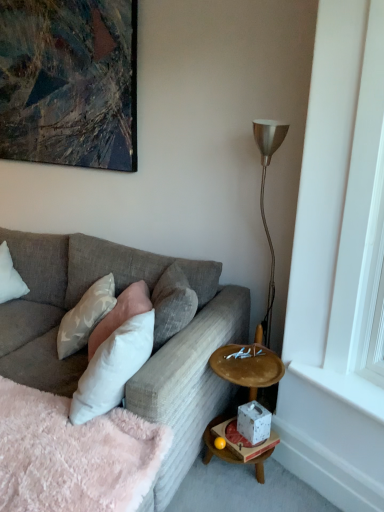
Measure the distance between soft gray fabric pillow at center, the 1th pillow viewed from the right, and camera.

soft gray fabric pillow at center, the 1th pillow viewed from the right, and camera are 5.72 feet apart from each other.

Identify the location of white soft pillow at center, acting as the second pillow starting from the right. (121, 314).

What do you see at coordinates (59, 300) in the screenshot?
I see `textured gray couch at center` at bounding box center [59, 300].

Locate an element on the screen. white paper tissue box at lower right is located at coordinates (215, 447).

Does soft gray fabric pillow at center, which is the third pillow in left-to-right order, lie behind white speckled ceramic at lower right?

That is False.

Is soft gray fabric pillow at center, which is the third pillow in left-to-right order, not close to white speckled ceramic at lower right?

No, there isn't a large distance between soft gray fabric pillow at center, which is the third pillow in left-to-right order, and white speckled ceramic at lower right.

From a real-world perspective, is soft gray fabric pillow at center, which is the third pillow in left-to-right order, positioned over white speckled ceramic at lower right based on gravity?

Yes, from a real-world perspective, soft gray fabric pillow at center, which is the third pillow in left-to-right order, is above white speckled ceramic at lower right.

Between soft gray fabric pillow at center, which is the third pillow in left-to-right order, and white speckled ceramic at lower right, which one has larger size?

Bigger between the two is soft gray fabric pillow at center, which is the third pillow in left-to-right order.

Does fluffy pink blanket at lower left contain white soft pillow at left, marked as the first pillow in a left-to-right arrangement?

No, white soft pillow at left, marked as the first pillow in a left-to-right arrangement, is located outside of fluffy pink blanket at lower left.

Locate an element on the screen. pillow on the left of the fluffy pink blanket at lower left is located at coordinates (10, 277).

Can you confirm if fluffy pink blanket at lower left is wider than white soft pillow at left, marked as the first pillow in a left-to-right arrangement?

Indeed, fluffy pink blanket at lower left has a greater width compared to white soft pillow at left, marked as the first pillow in a left-to-right arrangement.

Based on their sizes in the image, would you say fluffy pink blanket at lower left is bigger or smaller than white soft pillow at left, which is counted as the 3th pillow, starting from the right?

fluffy pink blanket at lower left is bigger than white soft pillow at left, which is counted as the 3th pillow, starting from the right.

Based on the photo, from the image's perspective, is white speckled ceramic at lower right beneath white smooth window sill at lower right?

Yes, from the image's perspective, white speckled ceramic at lower right is below white smooth window sill at lower right.

Do you think white speckled ceramic at lower right is within white smooth window sill at lower right, or outside of it?

The correct answer is: outside.

Is white speckled ceramic at lower right facing away from white smooth window sill at lower right?

No, white speckled ceramic at lower right is not facing the opposite direction of white smooth window sill at lower right.

From the image's perspective, is metallic abstract painting at upper left under fluffy pink blanket at lower left?

Actually, metallic abstract painting at upper left appears above fluffy pink blanket at lower left in the image.

Is metallic abstract painting at upper left aimed at fluffy pink blanket at lower left?

No, metallic abstract painting at upper left is not oriented towards fluffy pink blanket at lower left.

How many degrees apart are the facing directions of metallic abstract painting at upper left and fluffy pink blanket at lower left?

The angle between the facing direction of metallic abstract painting at upper left and the facing direction of fluffy pink blanket at lower left is 0.97 degrees.

From a real-world perspective, who is located higher, metallic abstract painting at upper left or fluffy pink blanket at lower left?

metallic abstract painting at upper left, from a real-world perspective.

Considering the sizes of white paper tissue box at lower right and soft gray fabric pillow at center, which is the third pillow in left-to-right order, in the image, is white paper tissue box at lower right bigger or smaller than soft gray fabric pillow at center, which is the third pillow in left-to-right order,?

white paper tissue box at lower right is smaller than soft gray fabric pillow at center, which is the third pillow in left-to-right order.

Considering the points (256, 467) and (184, 315), which point is in front, point (256, 467) or point (184, 315)?

Point (184, 315)

There is a white paper tissue box at lower right. Where is `the 3rd pillow above it (from a real-world perspective)`? The width and height of the screenshot is (384, 512). the 3rd pillow above it (from a real-world perspective) is located at coordinates (172, 304).

Is soft gray fabric pillow at center, the 1th pillow viewed from the right, at the back of white paper tissue box at lower right?

That's not correct — white paper tissue box at lower right is not looking away from soft gray fabric pillow at center, the 1th pillow viewed from the right.

From a real-world perspective, who is located lower, textured gray couch at center or white soft pillow at left, marked as the first pillow in a left-to-right arrangement?

From a 3D spatial view, textured gray couch at center is below.

Is textured gray couch at center positioned in front of white soft pillow at left, which is counted as the 3th pillow, starting from the right?

Yes, the depth of textured gray couch at center is less than that of white soft pillow at left, which is counted as the 3th pillow, starting from the right.

Is textured gray couch at center facing away from white soft pillow at left, marked as the first pillow in a left-to-right arrangement?

That's not correct — textured gray couch at center is not looking away from white soft pillow at left, marked as the first pillow in a left-to-right arrangement.

Looking at their sizes, would you say textured gray couch at center is wider or thinner than white soft pillow at left, which is counted as the 3th pillow, starting from the right?

Clearly, textured gray couch at center has more width compared to white soft pillow at left, which is counted as the 3th pillow, starting from the right.

Are white smooth window sill at lower right and metallic abstract painting at upper left far apart?

Indeed, white smooth window sill at lower right is not near metallic abstract painting at upper left.

From the image's perspective, would you say white smooth window sill at lower right is shown under metallic abstract painting at upper left?

Indeed, from the image's perspective, white smooth window sill at lower right is shown beneath metallic abstract painting at upper left.

Considering the sizes of objects white smooth window sill at lower right and metallic abstract painting at upper left in the image provided, who is thinner, white smooth window sill at lower right or metallic abstract painting at upper left?

metallic abstract painting at upper left is thinner.

From a real-world perspective, is white smooth window sill at lower right positioned over metallic abstract painting at upper left based on gravity?

No, from a real-world perspective, white smooth window sill at lower right is not on top of metallic abstract painting at upper left.

Where is `candle holder below the soft gray fabric pillow at center, which is the third pillow in left-to-right order (from a real-world perspective)`? The height and width of the screenshot is (512, 384). candle holder below the soft gray fabric pillow at center, which is the third pillow in left-to-right order (from a real-world perspective) is located at coordinates (254, 422).

Identify the location of bedding in front of the white soft pillow at left, marked as the first pillow in a left-to-right arrangement. (73, 455).

When comparing their distances from white smooth window sill at lower right, does soft gray fabric pillow at center, which is the third pillow in left-to-right order, or white soft pillow at left, which is counted as the 3th pillow, starting from the right, seem further?

white soft pillow at left, which is counted as the 3th pillow, starting from the right, is positioned further to the anchor white smooth window sill at lower right.

Based on their spatial positions, is metallic abstract painting at upper left or fluffy pink blanket at lower left closer to white smooth window sill at lower right?

Based on the image, fluffy pink blanket at lower left appears to be nearer to white smooth window sill at lower right.

When comparing their distances from white paper tissue box at lower right, does fluffy pink blanket at lower left or white speckled ceramic at lower right seem closer?

Among the two, white speckled ceramic at lower right is located nearer to white paper tissue box at lower right.

Considering their positions, is white soft pillow at center, acting as the second pillow starting from the right, positioned further to fluffy pink blanket at lower left than metallic abstract painting at upper left?

Based on the image, metallic abstract painting at upper left appears to be further to fluffy pink blanket at lower left.

From the image, which object appears to be nearer to white paper tissue box at lower right, white soft pillow at left, which is counted as the 3th pillow, starting from the right, or soft gray fabric pillow at center, which is the third pillow in left-to-right order?

soft gray fabric pillow at center, which is the third pillow in left-to-right order, lies closer to white paper tissue box at lower right than the other object.

When comparing their distances from metallic abstract painting at upper left, does white smooth window sill at lower right or white speckled ceramic at lower right seem closer?

white smooth window sill at lower right is closer to metallic abstract painting at upper left.

When comparing their distances from textured gray couch at center, does white soft pillow at center, the second pillow viewed from the left, or metallic abstract painting at upper left seem closer?

Among the two, white soft pillow at center, the second pillow viewed from the left, is located nearer to textured gray couch at center.

Which object lies nearer to the anchor point white speckled ceramic at lower right, white soft pillow at center, acting as the second pillow starting from the right, or white paper tissue box at lower right?

Based on the image, white paper tissue box at lower right appears to be nearer to white speckled ceramic at lower right.

You are a GUI agent. You are given a task and a screenshot of the screen. Output one action in this format:
    pyautogui.click(x=<x>, y=<y>)
    Task: Click on the candle holder between white soft pillow at left, which is counted as the 3th pillow, starting from the right, and white smooth window sill at lower right, in the horizontal direction
    The width and height of the screenshot is (384, 512).
    Given the screenshot: What is the action you would take?
    pyautogui.click(x=254, y=422)

Where is `table between soft gray fabric pillow at center, which is the third pillow in left-to-right order, and white smooth window sill at lower right, in the horizontal direction`? table between soft gray fabric pillow at center, which is the third pillow in left-to-right order, and white smooth window sill at lower right, in the horizontal direction is located at coordinates (215, 447).

Image resolution: width=384 pixels, height=512 pixels. Identify the location of candle holder between metallic abstract painting at upper left and white paper tissue box at lower right vertically. (254, 422).

This screenshot has height=512, width=384. In order to click on table between fluffy pink blanket at lower left and white smooth window sill at lower right in the horizontal direction in this screenshot , I will do `click(215, 447)`.